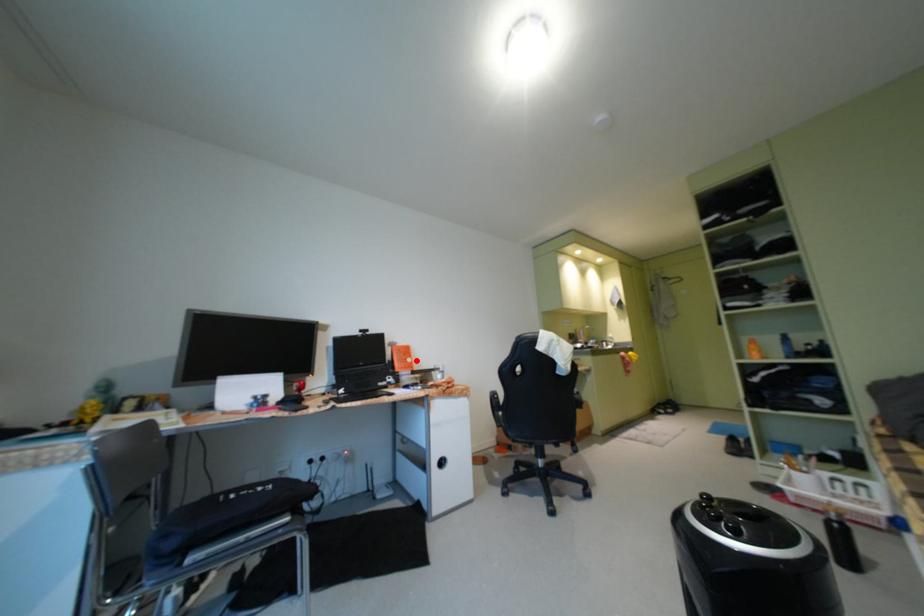
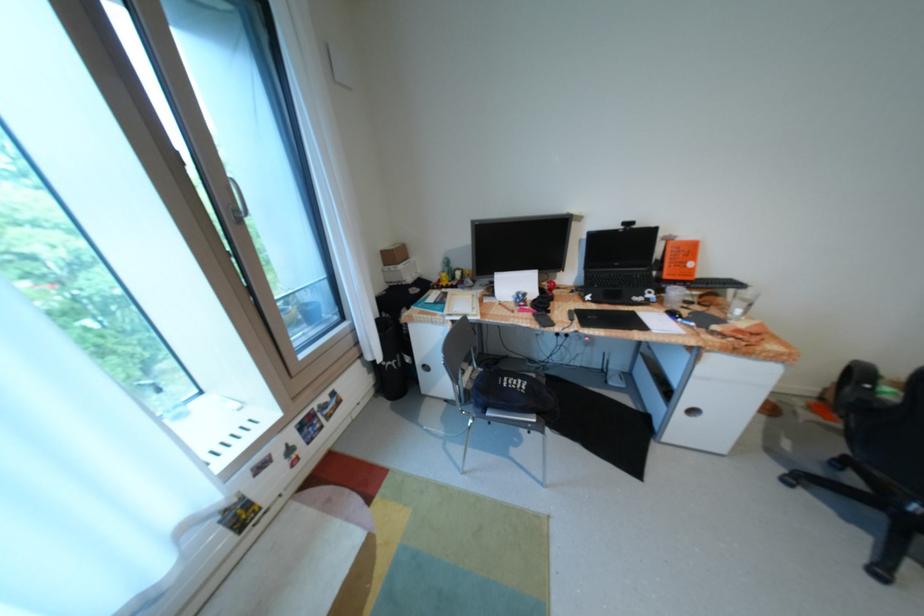
Question: I am providing you with two images of the same scene from different viewpoints. A red point is marked on the first image. At the location where the point appears in image 1, is it still visible in image 2?

Choices:
 (A) Yes
 (B) No

Answer: (A)